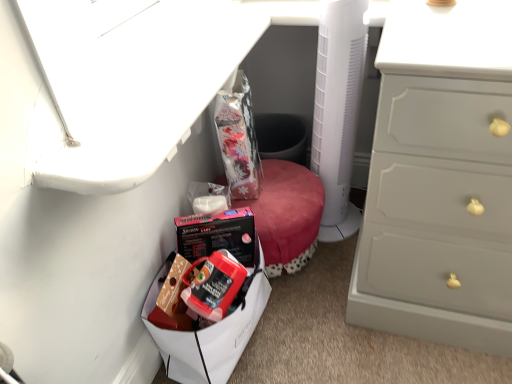
I want to click on metallic silver vanity at upper left, so click(139, 77).

The width and height of the screenshot is (512, 384). Describe the element at coordinates (287, 215) in the screenshot. I see `matte black box at lower center` at that location.

Find the location of a particular element. matte plastic lunch box at lower left is located at coordinates (211, 327).

You are a GUI agent. You are given a task and a screenshot of the screen. Output one action in this format:
    pyautogui.click(x=<x>, y=<y>)
    Task: Click on the metallic silver vanity at upper left
    This screenshot has height=384, width=512.
    Given the screenshot: What is the action you would take?
    pyautogui.click(x=139, y=77)

Considering the sizes of objects white plastic fan at center and metallic silver vanity at upper left in the image provided, who is shorter, white plastic fan at center or metallic silver vanity at upper left?

With less height is metallic silver vanity at upper left.

Which object is more forward, white plastic fan at center or metallic silver vanity at upper left?

metallic silver vanity at upper left is more forward.

Would you say white plastic fan at center is outside metallic silver vanity at upper left?

Indeed, white plastic fan at center is completely outside metallic silver vanity at upper left.

Is white plastic fan at center placed right next to matte plastic lunch box at lower left?

No, white plastic fan at center is not with matte plastic lunch box at lower left.

Does point (324, 224) appear closer or farther from the camera than point (207, 364)?

Point (324, 224) is positioned farther from the camera compared to point (207, 364).

In terms of size, does white plastic fan at center appear bigger or smaller than matte plastic lunch box at lower left?

Clearly, white plastic fan at center is smaller in size than matte plastic lunch box at lower left.

Is white plastic fan at center to the left or to the right of matte plastic lunch box at lower left in the image?

white plastic fan at center is positioned on matte plastic lunch box at lower left's right side.

Considering the positions of points (281, 197) and (223, 330), is point (281, 197) farther from camera compared to point (223, 330)?

Yes, point (281, 197) is behind point (223, 330).

Considering the relative sizes of matte black box at lower center and matte plastic lunch box at lower left in the image provided, is matte black box at lower center shorter than matte plastic lunch box at lower left?

Yes.

Who is smaller, matte black box at lower center or matte plastic lunch box at lower left?

Smaller between the two is matte plastic lunch box at lower left.

How many degrees apart are the facing directions of metallic silver vanity at upper left and white plastic fan at center?

metallic silver vanity at upper left and white plastic fan at center are facing 2.45 degrees away from each other.

Looking at their sizes, would you say metallic silver vanity at upper left is wider or thinner than white plastic fan at center?

In the image, metallic silver vanity at upper left appears to be wider than white plastic fan at center.

Measure the distance from metallic silver vanity at upper left to white plastic fan at center.

A distance of 37.71 centimeters exists between metallic silver vanity at upper left and white plastic fan at center.

Is metallic silver vanity at upper left at the left side of white plastic fan at center?

Yes, metallic silver vanity at upper left is to the left of white plastic fan at center.

In the image, is metallic silver vanity at upper left on the left side or the right side of matte black box at lower center?

metallic silver vanity at upper left is positioned on matte black box at lower center's left side.

Who is more distant, metallic silver vanity at upper left or matte black box at lower center?

matte black box at lower center is further away from the camera.

Locate an element on the screen. furniture that is behind the metallic silver vanity at upper left is located at coordinates (287, 215).

From the image's perspective, which one is positioned lower, metallic silver vanity at upper left or matte black box at lower center?

matte black box at lower center.

Considering the positions of objects matte plastic lunch box at lower left and matte black box at lower center in the image provided, who is more to the left, matte plastic lunch box at lower left or matte black box at lower center?

From the viewer's perspective, matte plastic lunch box at lower left appears more on the left side.

Is matte plastic lunch box at lower left facing away from matte black box at lower center?

matte plastic lunch box at lower left does not have its back to matte black box at lower center.

Is matte plastic lunch box at lower left completely or partially outside of matte black box at lower center?

That's correct, matte plastic lunch box at lower left is outside of matte black box at lower center.

Between point (216, 331) and point (277, 215), which one is positioned in front?

The point (216, 331) is closer to the camera.

Considering the positions of objects matte plastic lunch box at lower left and metallic silver vanity at upper left in the image provided, who is more to the right, matte plastic lunch box at lower left or metallic silver vanity at upper left?

matte plastic lunch box at lower left.

Between matte plastic lunch box at lower left and metallic silver vanity at upper left, which one has larger width?

With larger width is metallic silver vanity at upper left.

Is matte plastic lunch box at lower left turned away from metallic silver vanity at upper left?

No, matte plastic lunch box at lower left's orientation is not away from metallic silver vanity at upper left.

Locate an element on the screen. The height and width of the screenshot is (384, 512). lunch box below the metallic silver vanity at upper left (from a real-world perspective) is located at coordinates (211, 327).

Find the location of a particular element. Image resolution: width=512 pixels, height=384 pixels. vanity above the white plastic fan at center (from the image's perspective) is located at coordinates (139, 77).

The image size is (512, 384). What are the coordinates of `lunch box that is in front of the white plastic fan at center` in the screenshot? It's located at click(211, 327).

When comparing their distances from matte black box at lower center, does metallic silver vanity at upper left or matte plastic lunch box at lower left seem closer?

Based on the image, matte plastic lunch box at lower left appears to be nearer to matte black box at lower center.

Which object lies further to the anchor point white plastic fan at center, metallic silver vanity at upper left or matte plastic lunch box at lower left?

Based on the image, matte plastic lunch box at lower left appears to be further to white plastic fan at center.

Based on the photo, which object lies further to the anchor point metallic silver vanity at upper left, matte plastic lunch box at lower left or matte black box at lower center?

matte black box at lower center is positioned further to the anchor metallic silver vanity at upper left.

From the image, which object appears to be farther from white plastic fan at center, matte black box at lower center or metallic silver vanity at upper left?

The object further to white plastic fan at center is metallic silver vanity at upper left.

From the image, which object appears to be nearer to white plastic fan at center, matte plastic lunch box at lower left or matte black box at lower center?

Among the two, matte black box at lower center is located nearer to white plastic fan at center.

Based on their spatial positions, is metallic silver vanity at upper left or matte black box at lower center closer to matte plastic lunch box at lower left?

Among the two, matte black box at lower center is located nearer to matte plastic lunch box at lower left.

From the image, which object appears to be farther from white plastic fan at center, matte plastic lunch box at lower left or metallic silver vanity at upper left?

matte plastic lunch box at lower left is positioned further to the anchor white plastic fan at center.

When comparing their distances from metallic silver vanity at upper left, does white plastic fan at center or matte plastic lunch box at lower left seem further?

matte plastic lunch box at lower left is positioned further to the anchor metallic silver vanity at upper left.

Find the location of a particular element. Image resolution: width=512 pixels, height=384 pixels. appliance between metallic silver vanity at upper left and matte plastic lunch box at lower left vertically is located at coordinates (338, 111).

You are a GUI agent. You are given a task and a screenshot of the screen. Output one action in this format:
    pyautogui.click(x=<x>, y=<y>)
    Task: Click on the furniture between white plastic fan at center and matte plastic lunch box at lower left vertically
    
    Given the screenshot: What is the action you would take?
    pyautogui.click(x=287, y=215)

The width and height of the screenshot is (512, 384). Identify the location of furniture that lies between metallic silver vanity at upper left and matte plastic lunch box at lower left from top to bottom. (287, 215).

At what (x,y) coordinates should I click in order to perform the action: click on appliance located between metallic silver vanity at upper left and matte black box at lower center in the depth direction. Please return your answer as a coordinate pair (x, y). Looking at the image, I should click on (338, 111).